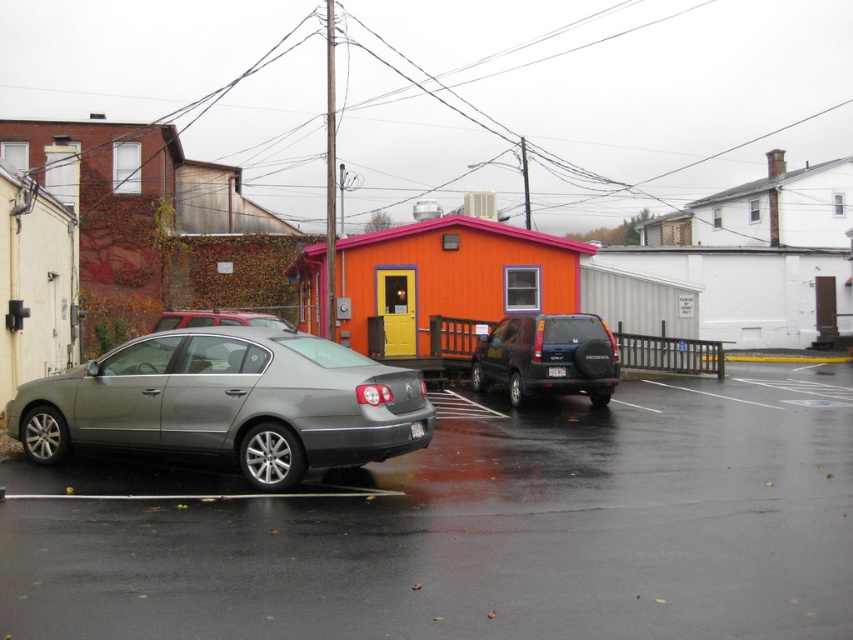
Which is below, orange matte/hardobject at upper center or orange matte building at center?

orange matte building at center is lower down.

Which of these two, orange matte/hardobject at upper center or orange matte building at center, stands taller?

orange matte/hardobject at upper center

Is point (144, 248) positioned behind point (53, 252)?

Yes.

Where is `orange matte/hardobject at upper center`? Image resolution: width=853 pixels, height=640 pixels. orange matte/hardobject at upper center is located at coordinates (155, 225).

Is satin silver car at lower left to the left of satin silver sedan at lower left from the viewer's perspective?

In fact, satin silver car at lower left is to the right of satin silver sedan at lower left.

Who is more distant from viewer, (393, 458) or (39, 406)?

The point (393, 458) is more distant.

Identify the location of satin silver car at lower left. (473, 529).

Can you confirm if orange matte building at center is bigger than dark gray matte suv at center?

Yes, orange matte building at center is bigger than dark gray matte suv at center.

Is orange matte building at center below dark gray matte suv at center?

Actually, orange matte building at center is above dark gray matte suv at center.

Is point (28, 374) positioned before point (527, 392)?

Yes, it is in front of point (527, 392).

Where is `orange matte building at center`? The image size is (853, 640). orange matte building at center is located at coordinates (35, 282).